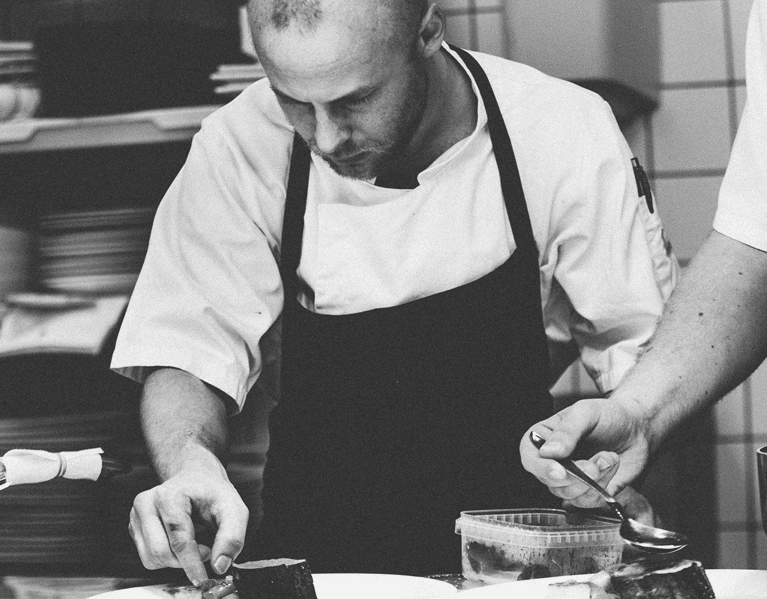
The height and width of the screenshot is (599, 767). I want to click on white table, so pyautogui.click(x=739, y=573).